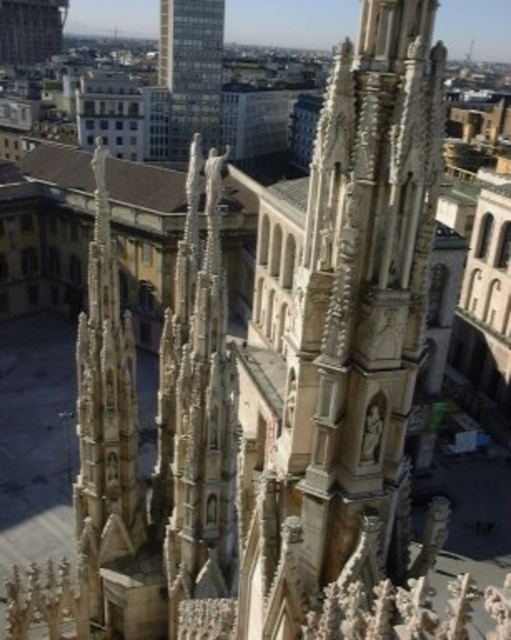
Question: Is smooth glass skyscraper at upper center positioned in front of smooth brown tower at upper left?

Choices:
 (A) no
 (B) yes

Answer: (B)

Question: Among these objects, which one is farthest from the camera?

Choices:
 (A) smooth glass skyscraper at upper center
 (B) smooth brown tower at upper left

Answer: (B)

Question: Is smooth glass skyscraper at upper center positioned behind smooth brown tower at upper left?

Choices:
 (A) no
 (B) yes

Answer: (A)

Question: Does smooth glass skyscraper at upper center appear on the left side of smooth brown tower at upper left?

Choices:
 (A) no
 (B) yes

Answer: (A)

Question: Among these points, which one is nearest to the camera?

Choices:
 (A) (62, 16)
 (B) (167, 84)

Answer: (B)

Question: Which object appears farthest from the camera in this image?

Choices:
 (A) smooth brown tower at upper left
 (B) smooth glass skyscraper at upper center

Answer: (A)